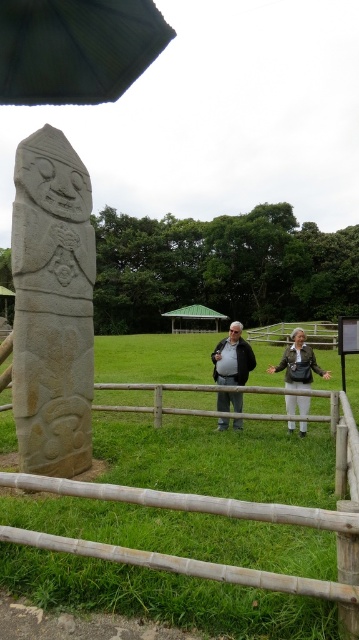
You are an architect designing a new garden layout. You need to place a statue that is 2 meters tall in this outdoor area. The dark gray stone couple at center and the wooden at center are existing structures. Which existing structure should you avoid placing the new statue next to to prevent blocking the view of the monument on the left?

You should avoid placing the new statue next to the dark gray stone couple at center because it has a greater height compared to the wooden at center, which could block the view of the monument on the left.

You are a gardener planning to mow the lawn. You see the green grass at center and the dark gray stone statue at center. Which area requires mowing, and why?

The green grass at center requires mowing because it is smaller than the dark gray stone statue at center, indicating it is the actual grassy area needing maintenance.

You are standing in the park and see the green grass at center and the dark gray stone statue at center. Which object is closer to you?

The green grass at center is closer to you because it is in front of the dark gray stone statue at center.